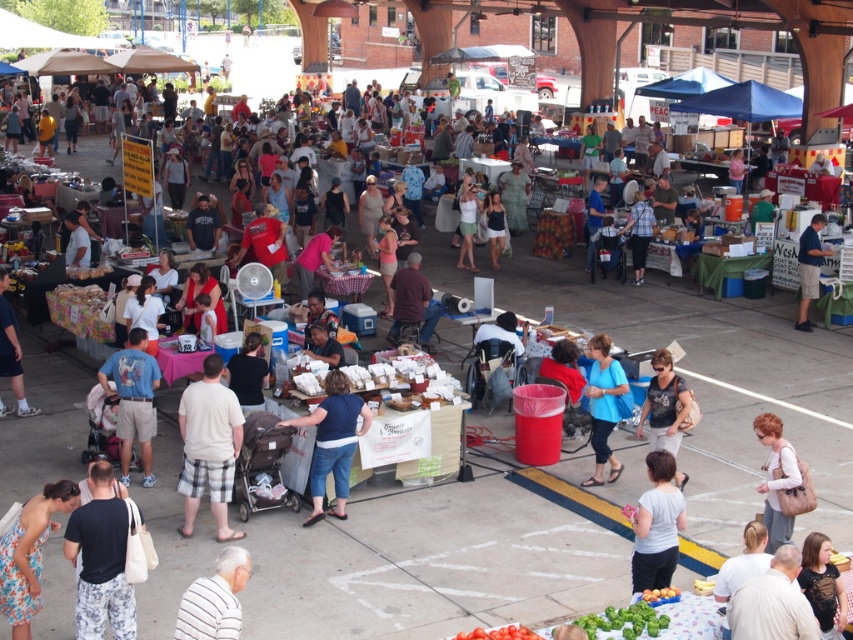
Is floral dress at lower left smaller than denim shorts at center?

Yes.

Who is higher up, floral dress at lower left or denim shorts at center?

denim shorts at center

Which is in front, point (10, 612) or point (679, 438)?

Point (10, 612)

Identify the location of floral dress at lower left. (28, 554).

Between point (132, 630) and point (663, 566), which one is positioned behind?

The point (663, 566) is more distant.

Is black cotton shirt at lower left wider than white matte shirt at lower center?

Yes, black cotton shirt at lower left is wider than white matte shirt at lower center.

Between point (115, 588) and point (660, 529), which one is positioned in front?

Point (115, 588)

At what (x,y) coordinates should I click in order to perform the action: click on black cotton shirt at lower left. Please return your answer as a coordinate pair (x, y). The height and width of the screenshot is (640, 853). Looking at the image, I should click on (102, 557).

Which is in front, point (659, 580) or point (769, 504)?

Point (659, 580) is in front.

Locate an element on the screen. white matte shirt at lower center is located at coordinates (656, 525).